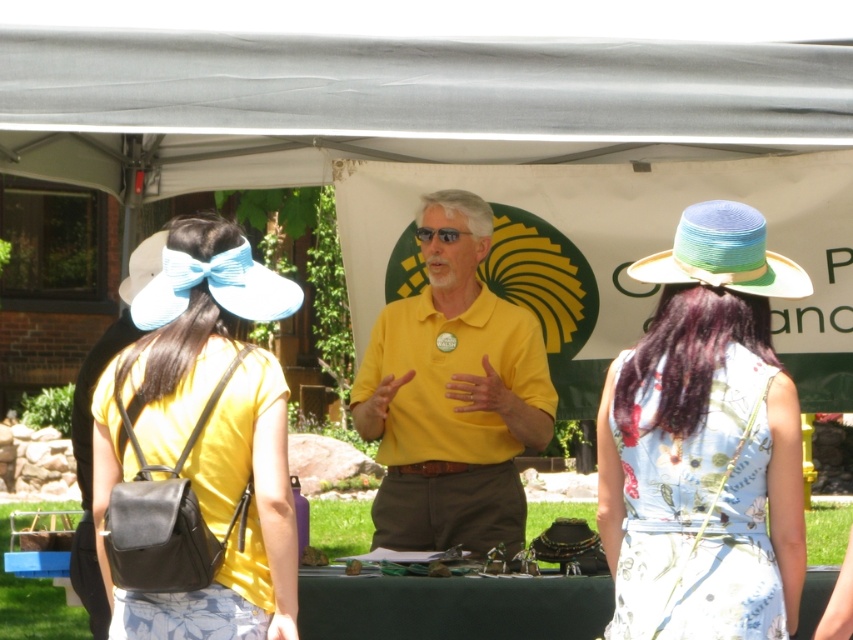
Question: Is the position of floral cotton dress at center less distant than that of white fabric visor at upper left?

Choices:
 (A) no
 (B) yes

Answer: (B)

Question: Which point appears closest to the camera in this image?

Choices:
 (A) (798, 269)
 (B) (418, 384)
 (C) (167, 257)

Answer: (A)

Question: Is yellow matte shirt at center wider than white fabric visor at upper left?

Choices:
 (A) no
 (B) yes

Answer: (A)

Question: Can you confirm if multicolored woven straw hat at upper right is wider than white fabric visor at upper left?

Choices:
 (A) no
 (B) yes

Answer: (A)

Question: Which of these objects is positioned farthest from the multicolored woven straw hat at upper right?

Choices:
 (A) yellow matte shirt at center
 (B) matte black backpack at left

Answer: (A)

Question: Estimate the real-world distances between objects in this image. Which object is closer to the floral cotton dress at center?

Choices:
 (A) white fabric visor at upper left
 (B) multicolored woven straw hat at upper right
 (C) light blue fabric visor at upper left
 (D) yellow matte shirt at center

Answer: (B)